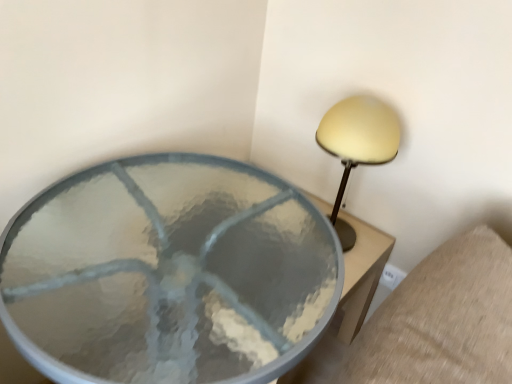
You are a GUI agent. You are given a task and a screenshot of the screen. Output one action in this format:
    pyautogui.click(x=<x>, y=<y>)
    Task: Click on the free spot above matte yellow lampshade at upper right (from a real-world perspective)
    This screenshot has width=512, height=384.
    Given the screenshot: What is the action you would take?
    pyautogui.click(x=366, y=114)